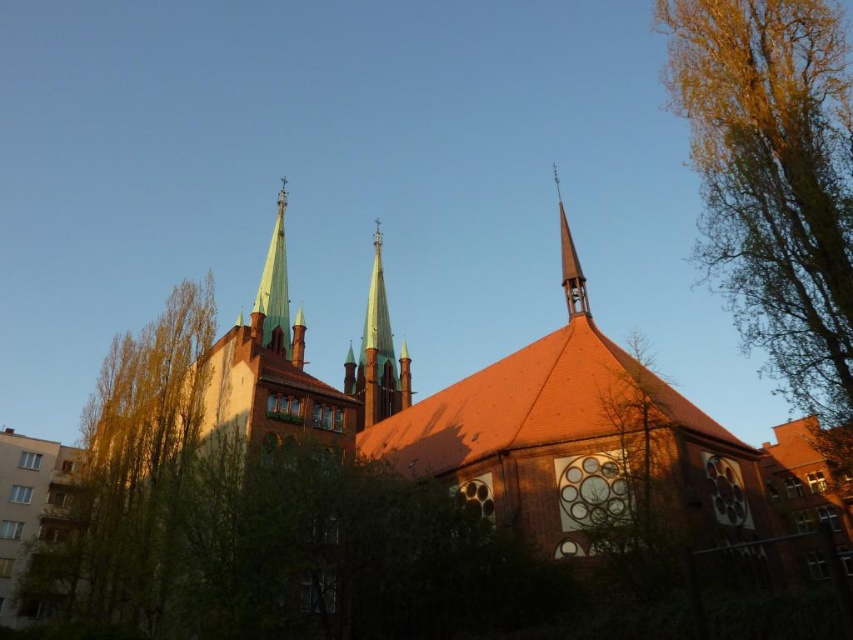
Is green glass spire at upper left closer to camera compared to smooth orange spire at center?

No, green glass spire at upper left is further to the viewer.

At what (x,y) coordinates should I click in order to perform the action: click on green glass spire at upper left. Please return your answer as a coordinate pair (x, y). This screenshot has height=640, width=853. Looking at the image, I should click on (274, 289).

Between point (277, 324) and point (564, 269), which one is positioned in front?

Point (564, 269) is more forward.

At what (x,y) coordinates should I click in order to perform the action: click on green glass spire at upper left. Please return your answer as a coordinate pair (x, y). The image size is (853, 640). Looking at the image, I should click on (274, 289).

Can you confirm if golden-brown bark tree at right is positioned below smooth glass spire at center?

No.

Between golden-brown bark tree at right and smooth glass spire at center, which one has less height?

Answer: smooth glass spire at center is shorter.

Between point (769, 163) and point (376, 406), which one is positioned behind?

Positioned behind is point (376, 406).

You are a GUI agent. You are given a task and a screenshot of the screen. Output one action in this format:
    pyautogui.click(x=<x>, y=<y>)
    Task: Click on the golden-brown bark tree at right
    The height and width of the screenshot is (640, 853).
    Given the screenshot: What is the action you would take?
    pyautogui.click(x=775, y=179)

Does brown brick church at center have a lesser width compared to green glass spire at upper left?

No.

Does brown brick church at center appear on the left side of green glass spire at upper left?

No, brown brick church at center is not to the left of green glass spire at upper left.

Find the location of a particular element. This screenshot has height=640, width=853. brown brick church at center is located at coordinates (381, 493).